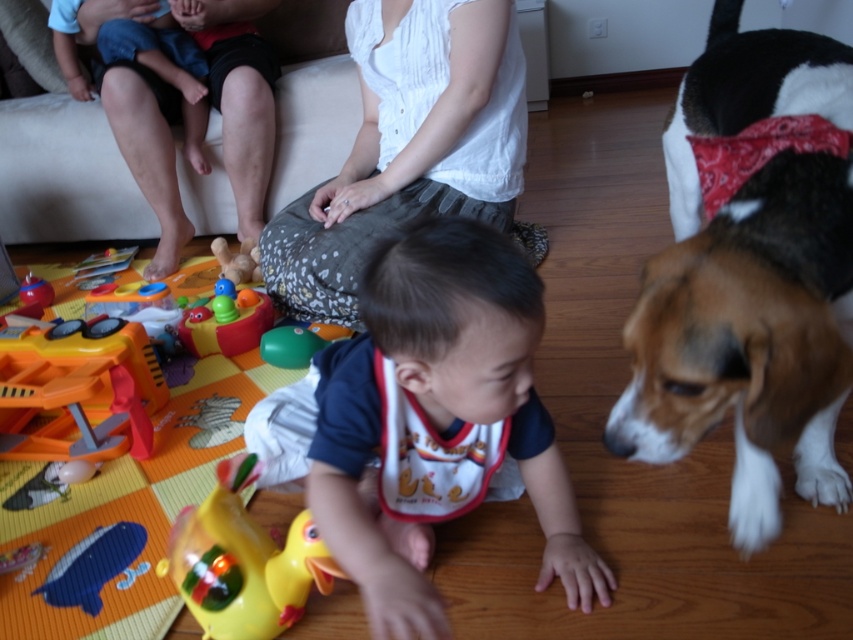
Question: Estimate the real-world distances between objects in this image. Which object is closer to the white cotton shirt at upper center?

Choices:
 (A) white fabric bib at center
 (B) rubber duck at center
 (C) rubber/plastic toy at center
 (D) orange plastic toy at lower left

Answer: (C)

Question: Which object is farther from the camera taking this photo?

Choices:
 (A) white cotton shirt at upper center
 (B) yellow rubber duck at center

Answer: (A)

Question: Is yellow rubber duck at center above orange plastic toy at lower left?

Choices:
 (A) yes
 (B) no

Answer: (A)

Question: Does white fabric bib at center have a larger size compared to rubber/plastic toy at center?

Choices:
 (A) yes
 (B) no

Answer: (A)

Question: Based on their relative distances, which object is farther from the yellow rubber duck at center?

Choices:
 (A) brown and white fur dog at right
 (B) yellow rubber duck at lower center
 (C) rubber duck at center
 (D) white cotton shirt at upper center

Answer: (C)

Question: Does yellow rubber duck at center appear on the right side of orange plastic toy at lower left?

Choices:
 (A) yes
 (B) no

Answer: (A)